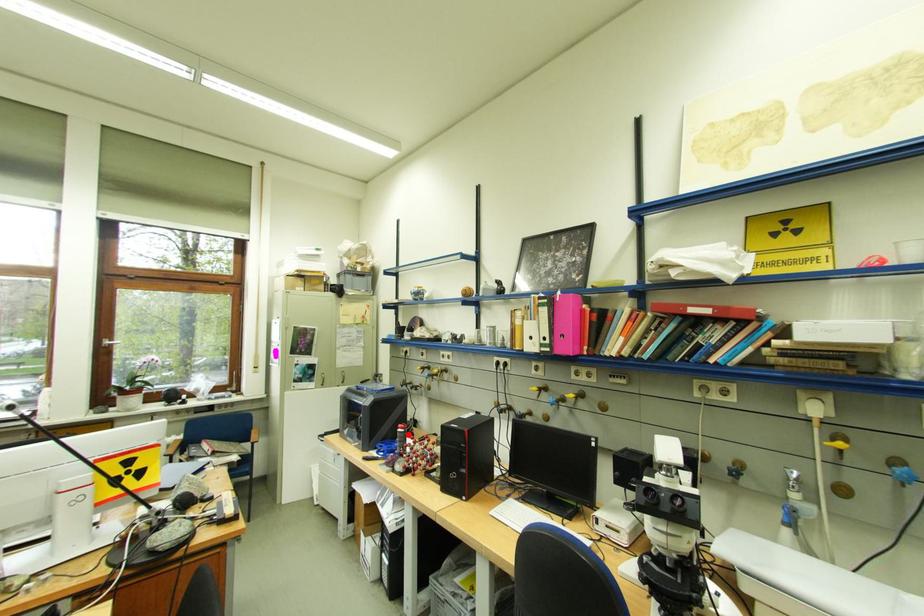
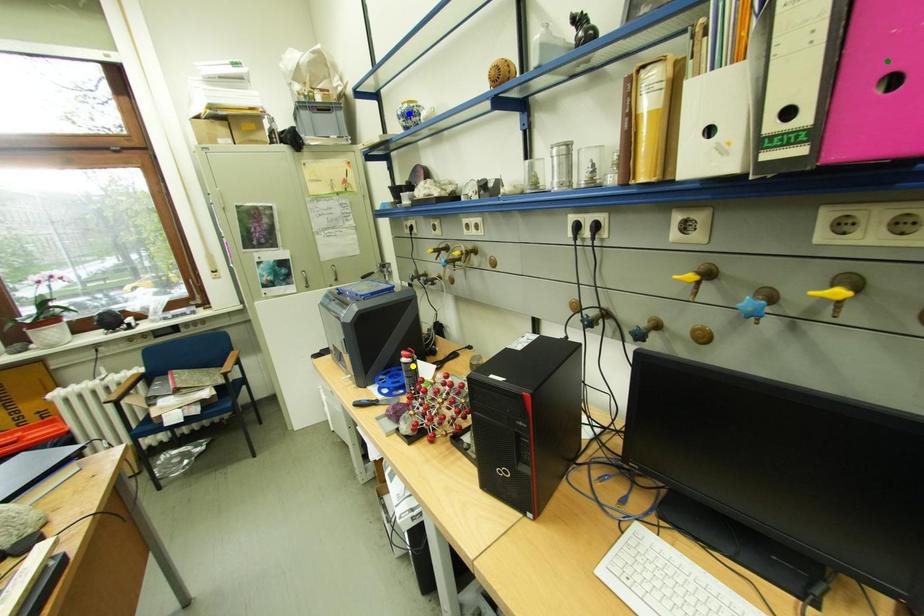
Question: I am providing you with two images of the same scene from different viewpoints. A red point is marked on the first image. You are given multiple points on the second image. Which spot in image 2 lines up with the point in image 1?

Choices:
 (A) green point
 (B) blue point
 (C) yellow point

Answer: (C)